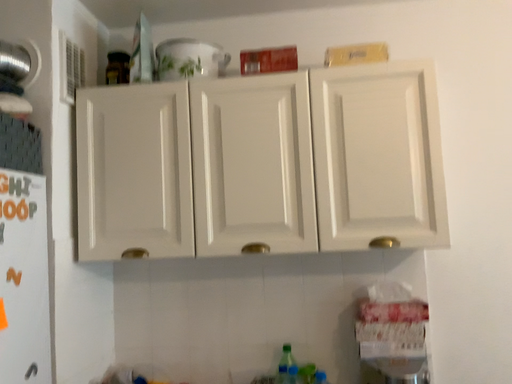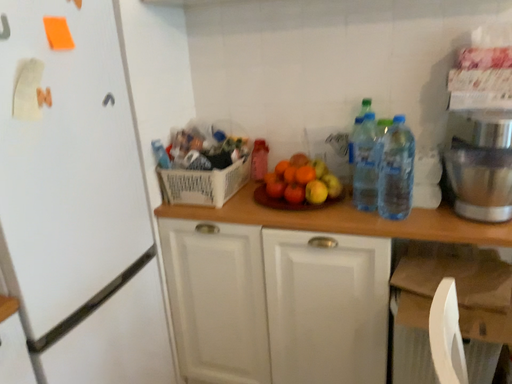
Question: How did the camera likely rotate when shooting the video?

Choices:
 (A) rotated upward
 (B) rotated downward

Answer: (B)